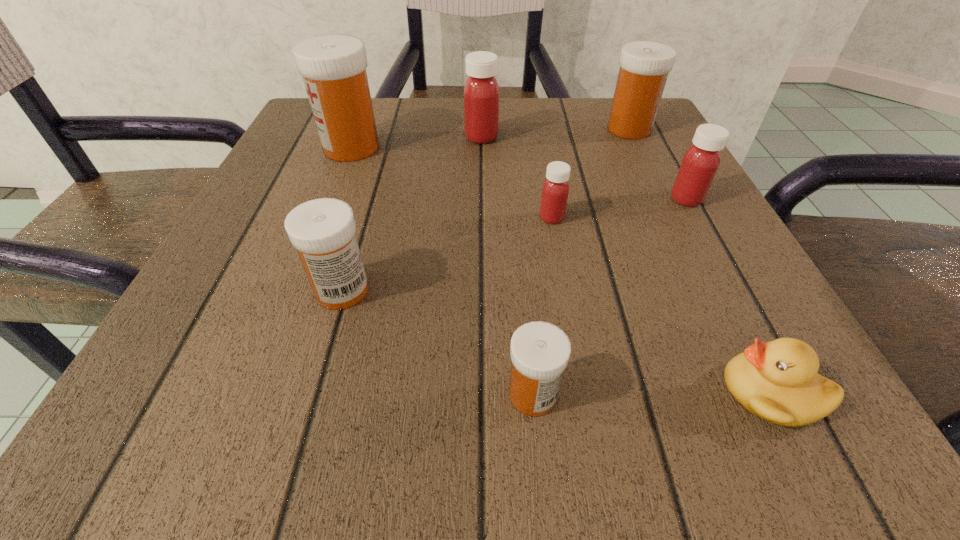
The width and height of the screenshot is (960, 540). What are the coordinates of `vacant region at the far edge of the desktop` in the screenshot? It's located at (577, 119).

Where is `vacant space at the near edge of the desktop`? vacant space at the near edge of the desktop is located at coordinates (315, 400).

Find the location of a particular element. The image size is (960, 540). free space at the left edge is located at coordinates (227, 299).

In the image, there is a desktop. In order to click on blank space at the right edge in this screenshot , I will do `click(667, 347)`.

You are a GUI agent. You are given a task and a screenshot of the screen. Output one action in this format:
    pyautogui.click(x=<x>, y=<y>)
    Task: Click on the vacant position at the far left corner of the desktop
    The image size is (960, 540).
    Given the screenshot: What is the action you would take?
    pyautogui.click(x=305, y=151)

Find the location of a particular element. This screenshot has width=960, height=540. blank space at the near left corner is located at coordinates (191, 437).

You are a GUI agent. You are given a task and a screenshot of the screen. Output one action in this format:
    pyautogui.click(x=<x>, y=<y>)
    Task: Click on the blank region between the smallest white medicine and the fourth object from right to left
    The image size is (960, 540).
    Given the screenshot: What is the action you would take?
    pyautogui.click(x=542, y=306)

The width and height of the screenshot is (960, 540). I want to click on vacant area between the nearest red medicine and the third smallest white medicine, so click(x=590, y=173).

I want to click on vacant point located between the duckling and the smallest white medicine, so click(652, 393).

Where is `unoccupied position between the nearest white medicine and the yellow duckling`? unoccupied position between the nearest white medicine and the yellow duckling is located at coordinates tap(652, 393).